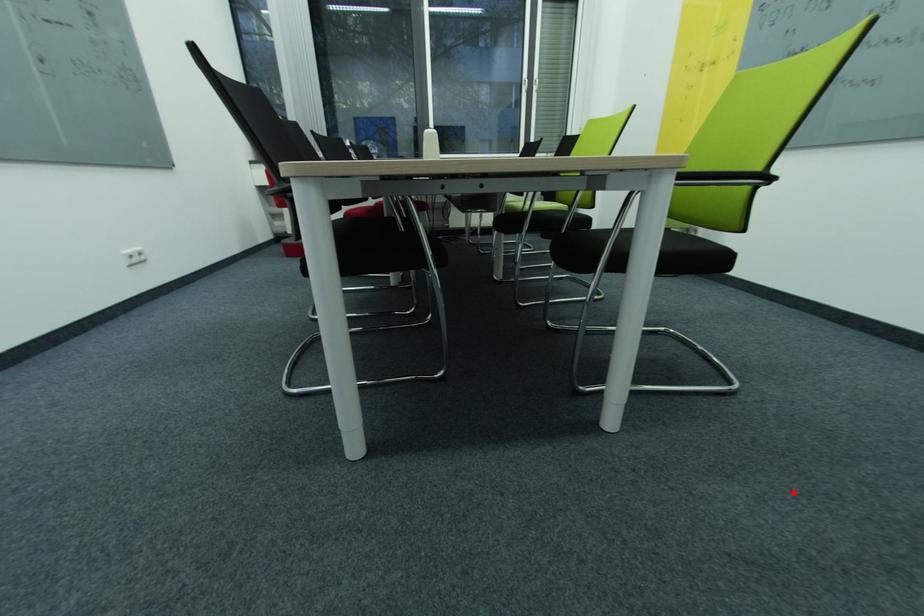
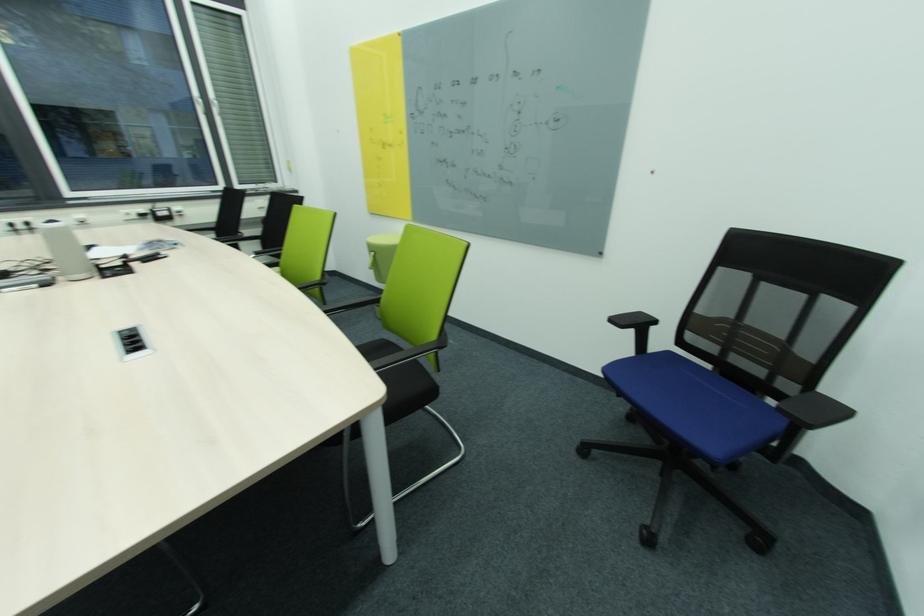
In the second image, find the point that corresponds to the highlighted location in the first image.

(503, 544)